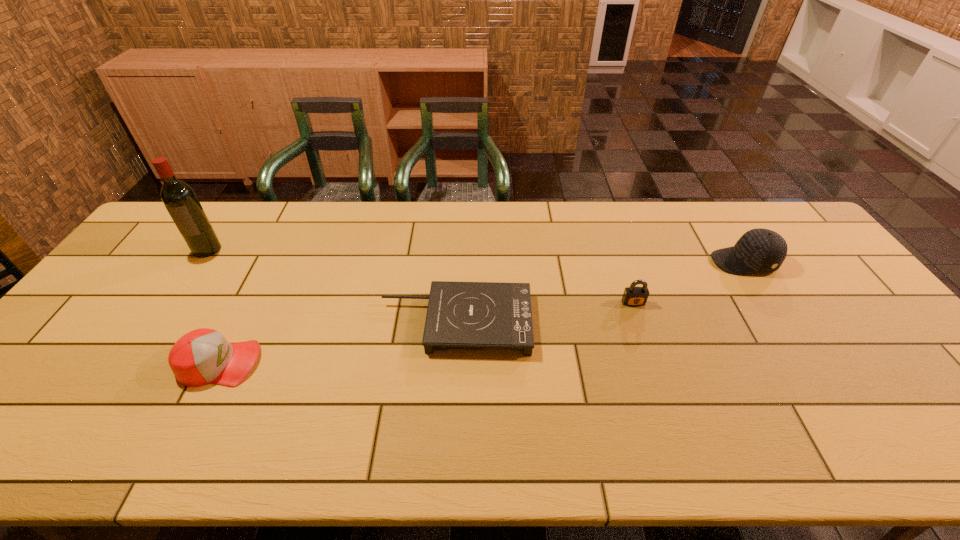
Where is `wine bottle`? The image size is (960, 540). wine bottle is located at coordinates (181, 202).

Locate an element on the screen. The image size is (960, 540). the leftmost object is located at coordinates (181, 202).

Identify the location of the farther baseball cap. (759, 250).

This screenshot has width=960, height=540. In order to click on the second tallest object in this screenshot , I will do (759, 250).

Find the location of a particular element. The image size is (960, 540). padlock is located at coordinates (633, 296).

Image resolution: width=960 pixels, height=540 pixels. I want to click on the left baseball cap, so click(x=203, y=356).

Find the location of a particular element. This screenshot has width=960, height=540. the shorter baseball cap is located at coordinates (203, 356).

This screenshot has width=960, height=540. What are the coordinates of `the shortest object` in the screenshot? It's located at (461, 315).

Locate an element on the screen. Image resolution: width=960 pixels, height=540 pixels. hotplate is located at coordinates (461, 315).

What are the coordinates of `free space located on the label of the wine bottle` in the screenshot? It's located at (169, 306).